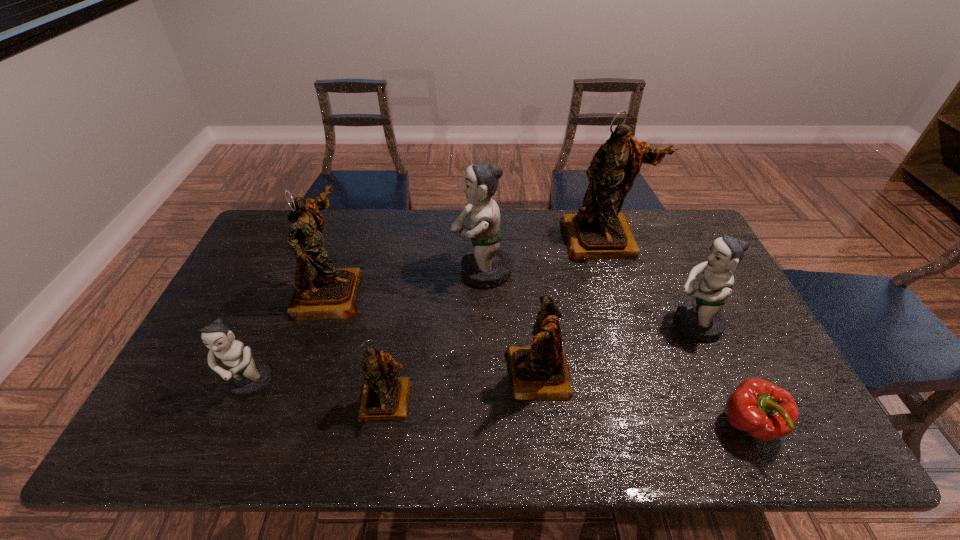
The height and width of the screenshot is (540, 960). Find the location of `the tallest object`. the tallest object is located at coordinates (598, 231).

Find the location of a particular element. the farthest gold figurine is located at coordinates (598, 231).

The width and height of the screenshot is (960, 540). I want to click on the second green figurine from left to right, so click(x=486, y=265).

Locate an element on the screen. This screenshot has height=540, width=960. the biggest green figurine is located at coordinates [486, 265].

Identify the location of the second biggest gold figurine. The width and height of the screenshot is (960, 540). (321, 291).

This screenshot has height=540, width=960. I want to click on the leftmost gold figurine, so click(321, 291).

Image resolution: width=960 pixels, height=540 pixels. Identify the location of the second smallest green figurine. (701, 319).

In order to click on the second farthest green figurine in this screenshot , I will do point(701,319).

Image resolution: width=960 pixels, height=540 pixels. I want to click on the third biggest gold figurine, so click(x=539, y=372).

I want to click on the sixth object from right to left, so click(384, 397).